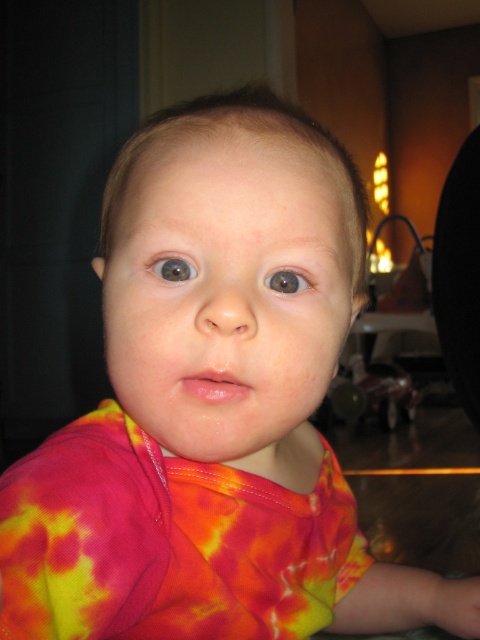
Is blue glossy eye at center positioned before brown matte eye at center?

Yes, blue glossy eye at center is in front of brown matte eye at center.

Which is more to the left, blue glossy eye at center or brown matte eye at center?

Positioned to the left is blue glossy eye at center.

Does point (184, 276) lie in front of point (266, 284)?

That is True.

Find the location of `blue glossy eye at center`. blue glossy eye at center is located at coordinates (173, 268).